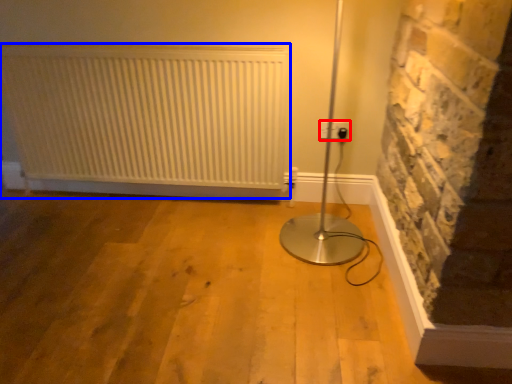
Question: Among these objects, which one is nearest to the camera, electric outlet (highlighted by a red box) or radiator (highlighted by a blue box)?

Choices:
 (A) electric outlet
 (B) radiator

Answer: (B)